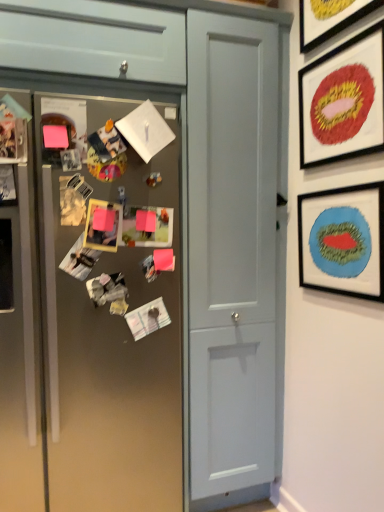
What do you see at coordinates (343, 101) in the screenshot? Image resolution: width=384 pixels, height=512 pixels. I see `matte red lips at upper right, acting as the second picture frame starting from the top` at bounding box center [343, 101].

The width and height of the screenshot is (384, 512). What do you see at coordinates (329, 18) in the screenshot? I see `yellow matte picture frame at upper right, arranged as the 3th picture frame when ordered from the bottom` at bounding box center [329, 18].

At what (x,y) coordinates should I click in order to perform the action: click on metallic silver photo frame at left, which is the 1th art from left to right. Please return your answer as a coordinate pair (x, y). The height and width of the screenshot is (512, 384). Looking at the image, I should click on (109, 292).

Locate an element on the screen. matte red lips at upper right, the 2th picture frame when ordered from bottom to top is located at coordinates (343, 101).

Between metallic silver photo frame at left, arranged as the first art when viewed from the front, and matte gray door at center, which one is positioned behind?

matte gray door at center is more distant.

There is a metallic silver photo frame at left, which is the 1th art from left to right. Identify the location of door above it (from a real-world perspective). (231, 250).

Is metallic silver photo frame at left, which is the 1th art from left to right, thinner than matte gray door at center?

Yes, metallic silver photo frame at left, which is the 1th art from left to right, is thinner than matte gray door at center.

Which is correct: metallic silver photo frame at center, the second art viewed from the front, is inside yellow matte picture frame at upper right, which appears as the 1th picture frame when viewed from the top, or outside of it?

The correct answer is: outside.

Are metallic silver photo frame at center, positioned as the first art in right-to-left order, and yellow matte picture frame at upper right, which appears as the 1th picture frame when viewed from the top, far apart?

metallic silver photo frame at center, positioned as the first art in right-to-left order, is far away from yellow matte picture frame at upper right, which appears as the 1th picture frame when viewed from the top.

Between metallic silver photo frame at center, which is the second art in left-to-right order, and yellow matte picture frame at upper right, which appears as the 1th picture frame when viewed from the top, which one appears on the right side from the viewer's perspective?

From the viewer's perspective, yellow matte picture frame at upper right, which appears as the 1th picture frame when viewed from the top, appears more on the right side.

Is metallic silver photo frame at center, the second art viewed from the front, taller than yellow matte picture frame at upper right, which appears as the 1th picture frame when viewed from the top?

No.

Looking at this image, based on their positions, is blue matte picture frame at right, acting as the third picture frame starting from the top, located to the left or right of yellow matte picture frame at upper right, which appears as the 1th picture frame when viewed from the top?

blue matte picture frame at right, acting as the third picture frame starting from the top, is positioned on yellow matte picture frame at upper right, which appears as the 1th picture frame when viewed from the top,'s right side.

Identify the location of the 2nd picture frame above the blue matte picture frame at right, marked as the first picture frame in a bottom-to-top arrangement (from a real-world perspective). The height and width of the screenshot is (512, 384). (329, 18).

From a real-world perspective, does blue matte picture frame at right, acting as the third picture frame starting from the top, stand above yellow matte picture frame at upper right, which appears as the 1th picture frame when viewed from the top?

Actually, blue matte picture frame at right, acting as the third picture frame starting from the top, is physically below yellow matte picture frame at upper right, which appears as the 1th picture frame when viewed from the top, in the real world.

From a real-world perspective, is matte red lips at upper right, the 2th picture frame when ordered from bottom to top, on metallic gray fridge at left?

Indeed, from a real-world perspective, matte red lips at upper right, the 2th picture frame when ordered from bottom to top, stands above metallic gray fridge at left.

In the image, there is a matte red lips at upper right, the 2th picture frame when ordered from bottom to top. At what (x,y) coordinates should I click in order to perform the action: click on fridge below it (from the image's perspective). Please return your answer as a coordinate pair (x, y). This screenshot has height=512, width=384. Looking at the image, I should click on (109, 310).

Does matte red lips at upper right, acting as the second picture frame starting from the top, have a smaller size compared to metallic gray fridge at left?

Yes.

Is matte red lips at upper right, the 2th picture frame when ordered from bottom to top, facing towards metallic gray fridge at left?

No.

Which is behind, blue matte picture frame at right, marked as the first picture frame in a bottom-to-top arrangement, or brushed metal cabinet at upper left?

Positioned behind is brushed metal cabinet at upper left.

Does blue matte picture frame at right, acting as the third picture frame starting from the top, touch brushed metal cabinet at upper left?

No, blue matte picture frame at right, acting as the third picture frame starting from the top, is not in contact with brushed metal cabinet at upper left.

Which of these two, blue matte picture frame at right, marked as the first picture frame in a bottom-to-top arrangement, or brushed metal cabinet at upper left, stands taller?

With more height is brushed metal cabinet at upper left.

Where is `cabinetry above the matte red lips at upper right, the 2th picture frame when ordered from bottom to top (from a real-world perspective)`? The width and height of the screenshot is (384, 512). cabinetry above the matte red lips at upper right, the 2th picture frame when ordered from bottom to top (from a real-world perspective) is located at coordinates (93, 39).

From a real-world perspective, relative to brushed metal cabinet at upper left, is matte red lips at upper right, the 2th picture frame when ordered from bottom to top, vertically above or below?

Clearly, from a real-world perspective, matte red lips at upper right, the 2th picture frame when ordered from bottom to top, is below brushed metal cabinet at upper left.

Could you measure the distance between matte red lips at upper right, acting as the second picture frame starting from the top, and brushed metal cabinet at upper left?

27.87 inches.

Can you confirm if matte red lips at upper right, acting as the second picture frame starting from the top, is bigger than brushed metal cabinet at upper left?

Incorrect, matte red lips at upper right, acting as the second picture frame starting from the top, is not larger than brushed metal cabinet at upper left.

From the image's perspective, is metallic gray fridge at left positioned above or below matte gray door at center?

metallic gray fridge at left is above matte gray door at center.

Between metallic gray fridge at left and matte gray door at center, which one has larger width?

Wider between the two is matte gray door at center.

Is metallic gray fridge at left closer to the viewer compared to matte gray door at center?

Yes, it is in front of matte gray door at center.

Is metallic gray fridge at left taller or shorter than matte gray door at center?

Considering their sizes, metallic gray fridge at left has less height than matte gray door at center.

In order to click on art in front of the matte gray door at center in this screenshot , I will do `click(109, 292)`.

At what (x,y) coordinates should I click in order to perform the action: click on the 1st art counting from the left of the yellow matte picture frame at upper right, which appears as the 1th picture frame when viewed from the top. Please return your answer as a coordinate pair (x, y). This screenshot has width=384, height=512. Looking at the image, I should click on (158, 263).

Looking at the image, which one is located closer to brushed metal cabinet at upper left, yellow matte picture frame at upper right, arranged as the 3th picture frame when ordered from the bottom, or blue matte picture frame at right, marked as the first picture frame in a bottom-to-top arrangement?

yellow matte picture frame at upper right, arranged as the 3th picture frame when ordered from the bottom, is positioned closer to the anchor brushed metal cabinet at upper left.

Estimate the real-world distances between objects in this image. Which object is further from blue matte picture frame at right, acting as the third picture frame starting from the top, matte gray door at center or brushed metal cabinet at upper left?

The object further to blue matte picture frame at right, acting as the third picture frame starting from the top, is brushed metal cabinet at upper left.

Which object lies nearer to the anchor point brushed metal cabinet at upper left, yellow matte picture frame at upper right, which appears as the 1th picture frame when viewed from the top, or metallic silver photo frame at center, placed as the 1th art when sorted from back to front?

yellow matte picture frame at upper right, which appears as the 1th picture frame when viewed from the top, lies closer to brushed metal cabinet at upper left than the other object.

Which object lies further to the anchor point metallic silver photo frame at center, which is the second art in left-to-right order, brushed metal cabinet at upper left or matte red lips at upper right, acting as the second picture frame starting from the top?

Based on the image, matte red lips at upper right, acting as the second picture frame starting from the top, appears to be further to metallic silver photo frame at center, which is the second art in left-to-right order.

Based on their spatial positions, is blue matte picture frame at right, acting as the third picture frame starting from the top, or matte gray door at center closer to metallic silver photo frame at center, placed as the 1th art when sorted from back to front?

matte gray door at center lies closer to metallic silver photo frame at center, placed as the 1th art when sorted from back to front, than the other object.

Which object lies further to the anchor point metallic gray fridge at left, brushed metal cabinet at upper left or metallic silver photo frame at left, acting as the second art starting from the right?

brushed metal cabinet at upper left is positioned further to the anchor metallic gray fridge at left.

Looking at the image, which one is located closer to matte gray door at center, matte red lips at upper right, acting as the second picture frame starting from the top, or blue matte picture frame at right, acting as the third picture frame starting from the top?

blue matte picture frame at right, acting as the third picture frame starting from the top.

Based on their spatial positions, is matte gray door at center or metallic silver photo frame at left, the 2th art from the back, further from metallic silver photo frame at center, the second art viewed from the front?

matte gray door at center.

Find the location of `art between brushed metal cabinet at upper left and metallic silver photo frame at left, which is the 1th art from left to right, from top to bottom`. art between brushed metal cabinet at upper left and metallic silver photo frame at left, which is the 1th art from left to right, from top to bottom is located at coordinates (158, 263).

The width and height of the screenshot is (384, 512). In order to click on door between brushed metal cabinet at upper left and matte red lips at upper right, acting as the second picture frame starting from the top, in the horizontal direction in this screenshot , I will do `click(231, 250)`.

Image resolution: width=384 pixels, height=512 pixels. What are the coordinates of `picture frame between yellow matte picture frame at upper right, which appears as the 1th picture frame when viewed from the top, and blue matte picture frame at right, acting as the third picture frame starting from the top, in the vertical direction` in the screenshot? It's located at [x=343, y=101].

This screenshot has width=384, height=512. Identify the location of door situated between metallic gray fridge at left and matte red lips at upper right, acting as the second picture frame starting from the top, from left to right. (231, 250).